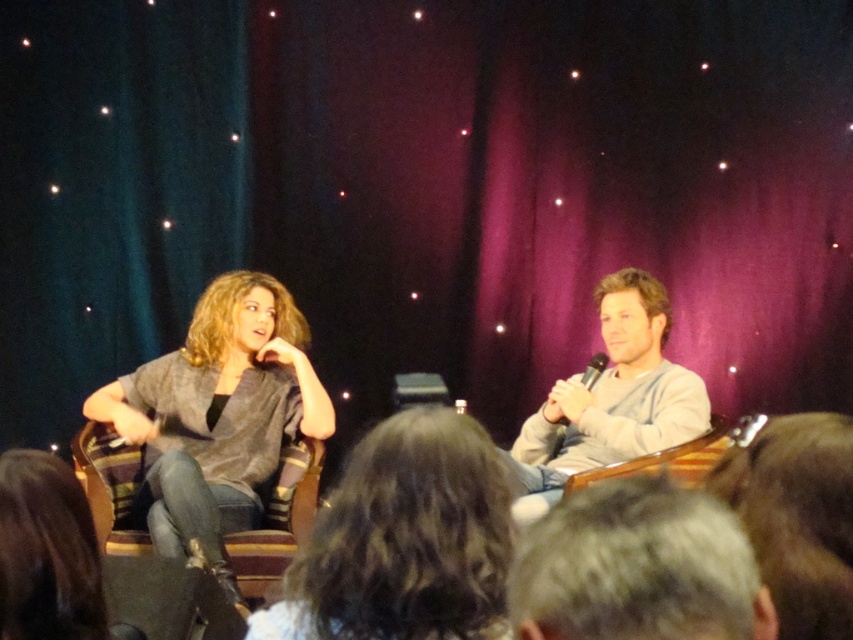
You are an event organizer who needs to set up a camera to capture both the gray fabric shirt at left and the black plastic microphone at center clearly. Based on their heights, which object should you adjust the camera angle to focus on first?

The gray fabric shirt at left is taller than the black plastic microphone at center, so you should adjust the camera angle to focus on the gray fabric shirt at left first to ensure both are in frame.

You are a photographer standing in front of the stage. You need to focus your camera on the gray sweater at center. What is the exact 2D coordinate point you should aim for?

The gray sweater at center is located at the 2D coordinate point of (404, 540). You should aim your camera at that exact point to focus on the gray sweater at center.

You are a sound technician setting up for a panel discussion. You have two microphones, one for the gray sweater at center and one for the gray cotton shirt at right. The microphones have a range of 1.5 meters. Will both speakers be within the microphones range if placed between them?

The distance between the gray sweater at center and gray cotton shirt at right is 1.75 meters. Since the microphones have a range of 1.5 meters, placing them between the two would mean each microphone is 0.875 meters away from their respective speaker. This distance is within the 1.5 meter range, so both speakers will be within range.